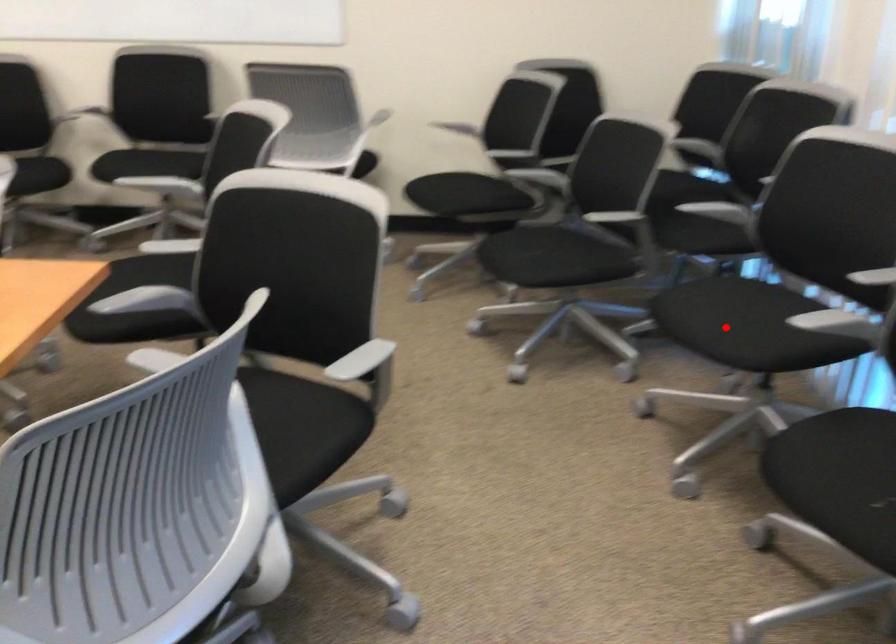
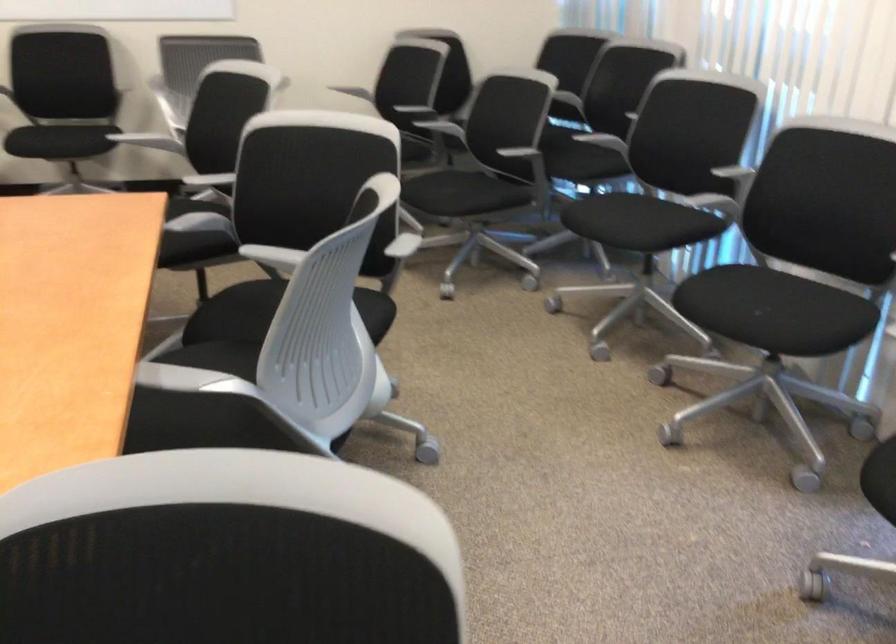
Find the pixel in the second image that matches the highlighted location in the first image.

(624, 221)